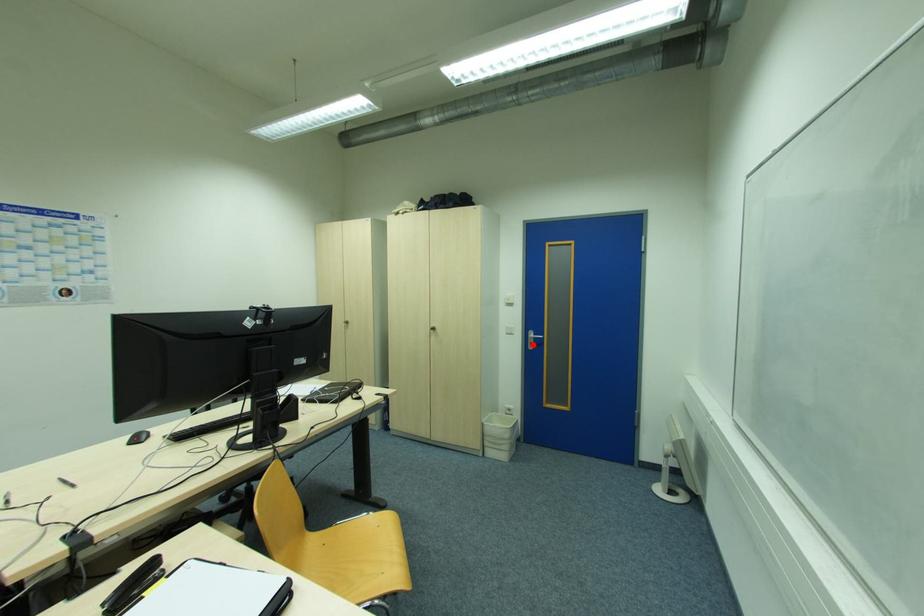
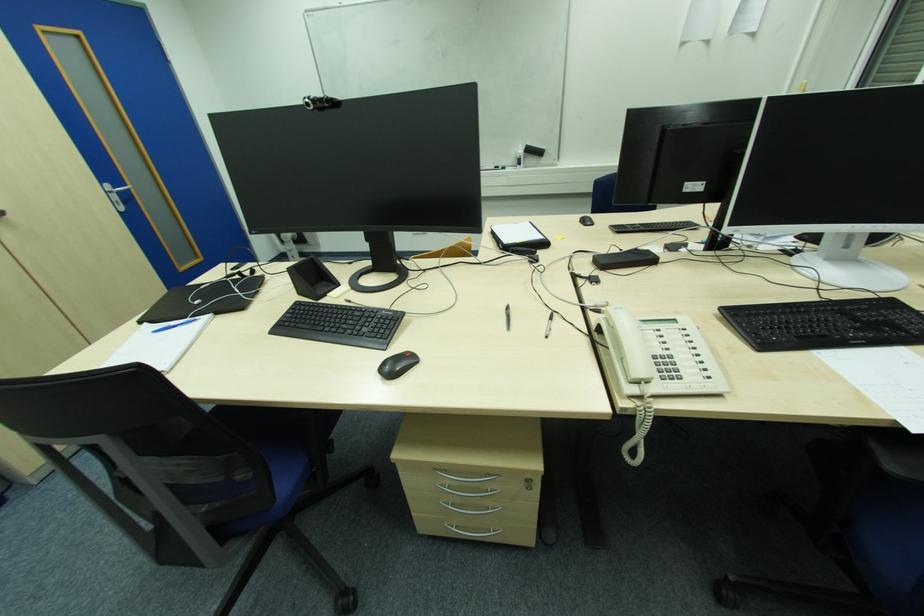
Find the pixel in the second image that matches the highlighted location in the first image.

(119, 204)